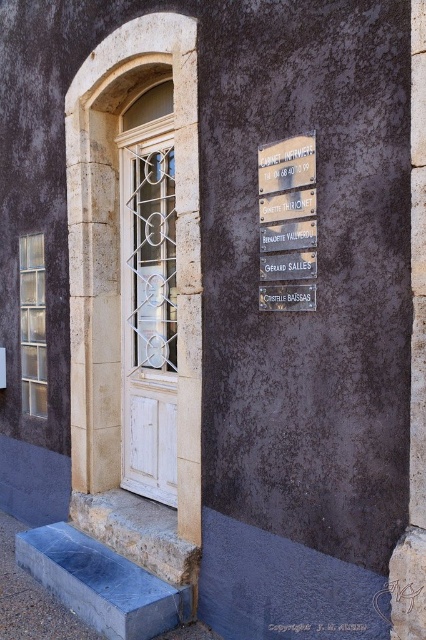
Question: Which point is farther to the camera?

Choices:
 (A) white wooden door at left
 (B) rustic wood sign at upper right

Answer: (A)

Question: Which object is closer to the camera taking this photo?

Choices:
 (A) white wooden door at left
 (B) rustic wood sign at upper right

Answer: (B)

Question: Which of the following is the farthest from the observer?

Choices:
 (A) (267, 276)
 (B) (149, 468)

Answer: (B)

Question: Can you confirm if white wooden door at left is positioned below rustic wood sign at upper right?

Choices:
 (A) yes
 (B) no

Answer: (A)

Question: Where is white wooden door at left located in relation to rustic wood sign at upper right in the image?

Choices:
 (A) below
 (B) above

Answer: (A)

Question: Can you confirm if white wooden door at left is wider than rustic wood sign at upper right?

Choices:
 (A) yes
 (B) no

Answer: (A)